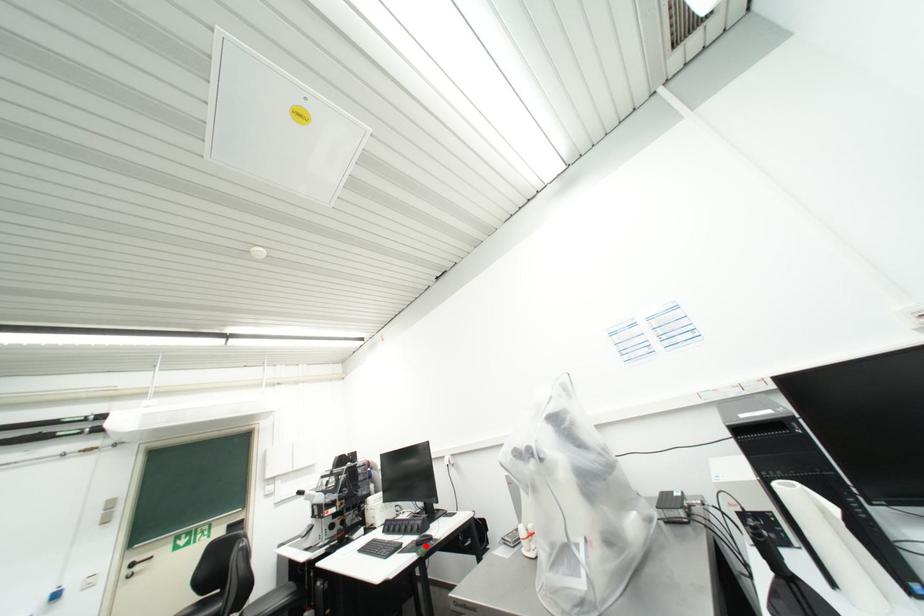
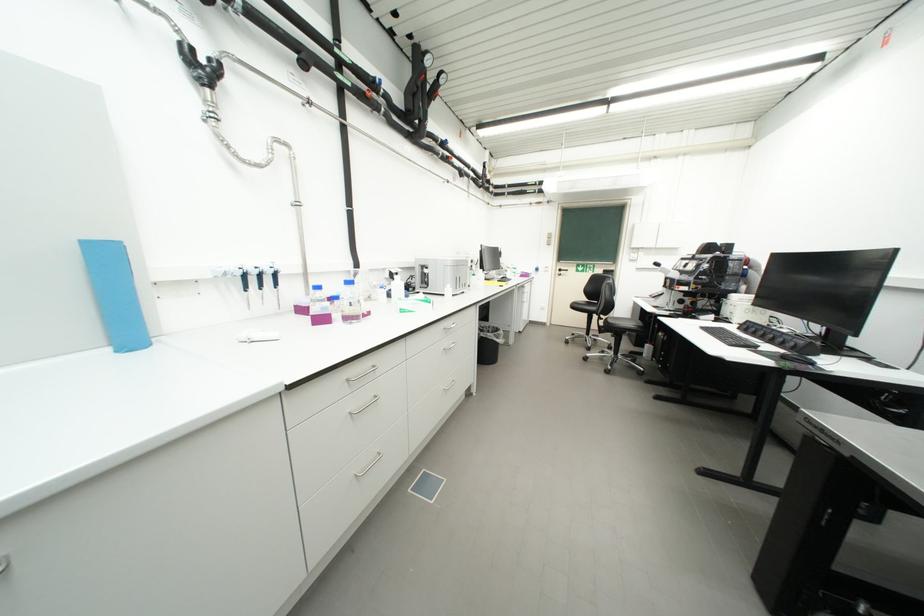
Question: I am providing you with two images of the same scene from different viewpoints. A red point is marked on the first image. Can you still see the location of the red point in image 2?

Choices:
 (A) Yes
 (B) No

Answer: (A)